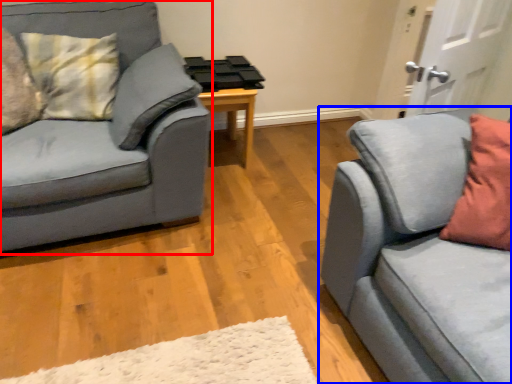
Question: Which of the following is the closest to the observer, studio couch (highlighted by a red box) or studio couch (highlighted by a blue box)?

Choices:
 (A) studio couch
 (B) studio couch

Answer: (B)